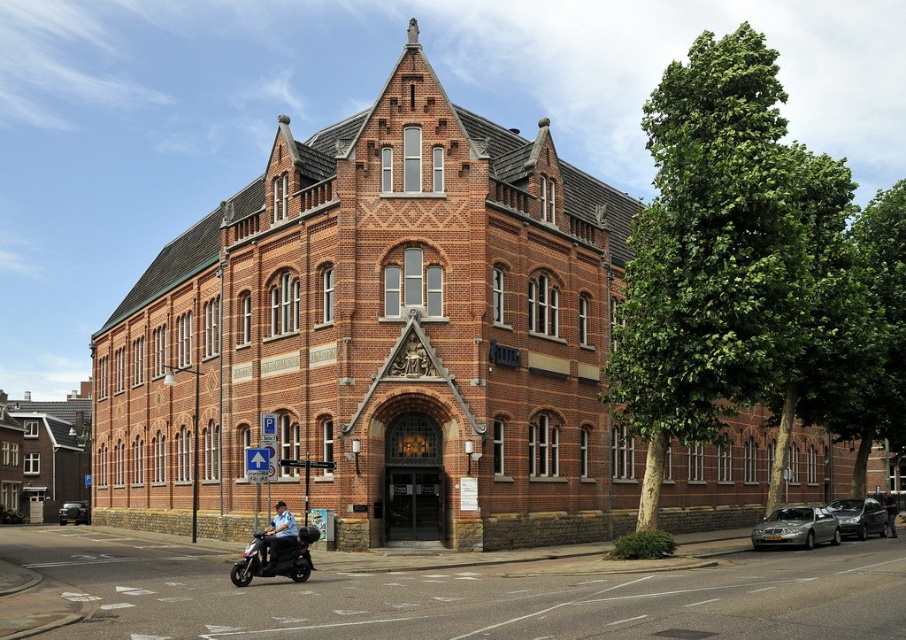
Question: Is satin silver metallic sedan at lower right wider than shiny silver sedan at lower right?

Choices:
 (A) yes
 (B) no

Answer: (A)

Question: Is brick building at center thinner than dark blue uniform at center?

Choices:
 (A) yes
 (B) no

Answer: (B)

Question: Is dark blue uniform at center above shiny black sedan at lower left?

Choices:
 (A) yes
 (B) no

Answer: (A)

Question: Among these objects, which one is farthest from the camera?

Choices:
 (A) satin silver metallic sedan at lower right
 (B) brick building at center
 (C) shiny silver sedan at lower right
 (D) dark blue uniform at center

Answer: (C)

Question: Among these objects, which one is nearest to the camera?

Choices:
 (A) shiny silver sedan at lower right
 (B) metallic silver scooter at lower left

Answer: (B)

Question: Among these points, which one is farthest from the camera?

Choices:
 (A) (872, 516)
 (B) (294, 545)
 (C) (789, 531)

Answer: (A)